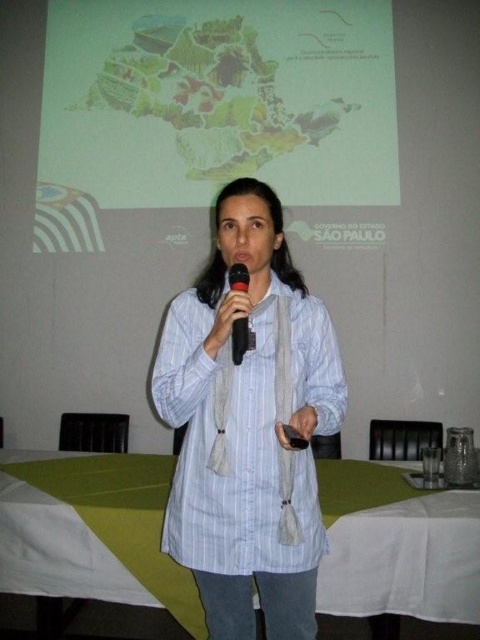
Can you confirm if white striped shirt at center is thinner than black plastic microphone at center?

Incorrect, white striped shirt at center's width is not less than black plastic microphone at center's.

Between white striped shirt at center and black plastic microphone at center, which one has more height?

white striped shirt at center

Locate an element on the screen. white striped shirt at center is located at coordinates (247, 426).

Find the location of a particular element. matte plastic map at upper center is located at coordinates (219, 99).

Based on the photo, does matte plastic map at upper center come in front of black plastic microphone at center?

No, matte plastic map at upper center is further to the viewer.

Describe the element at coordinates (219, 99) in the screenshot. I see `matte plastic map at upper center` at that location.

You are a GUI agent. You are given a task and a screenshot of the screen. Output one action in this format:
    pyautogui.click(x=<x>, y=<y>)
    Task: Click on the matte plastic map at upper center
    
    Given the screenshot: What is the action you would take?
    pyautogui.click(x=219, y=99)

What do you see at coordinates (219, 99) in the screenshot? The image size is (480, 640). I see `matte plastic map at upper center` at bounding box center [219, 99].

Describe the element at coordinates (219, 99) in the screenshot. Image resolution: width=480 pixels, height=640 pixels. I see `matte plastic map at upper center` at that location.

I want to click on matte plastic map at upper center, so click(219, 99).